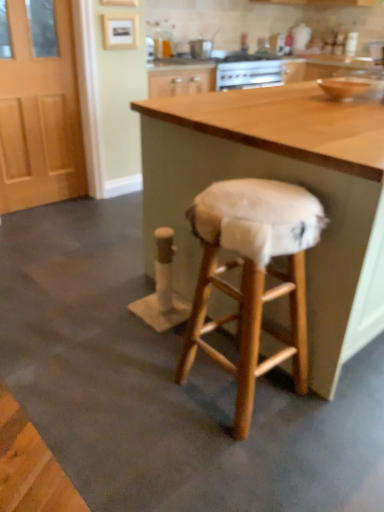
Question: Is light brown wooden door at left not within wooden table at center?

Choices:
 (A) yes
 (B) no

Answer: (A)

Question: Is there a large distance between light brown wooden door at left and wooden table at center?

Choices:
 (A) no
 (B) yes

Answer: (B)

Question: Does light brown wooden door at left turn towards wooden table at center?

Choices:
 (A) no
 (B) yes

Answer: (B)

Question: Is light brown wooden door at left behind wooden table at center?

Choices:
 (A) yes
 (B) no

Answer: (A)

Question: Considering the relative sizes of light brown wooden door at left and wooden table at center in the image provided, is light brown wooden door at left smaller than wooden table at center?

Choices:
 (A) yes
 (B) no

Answer: (A)

Question: Is the position of light brown wooden door at left less distant than that of wooden table at center?

Choices:
 (A) yes
 (B) no

Answer: (B)

Question: Is the depth of white fabric-covered stool at center greater than that of light brown wooden door at left?

Choices:
 (A) yes
 (B) no

Answer: (B)

Question: Does white fabric-covered stool at center contain light brown wooden door at left?

Choices:
 (A) no
 (B) yes

Answer: (A)

Question: From the image's perspective, is white fabric-covered stool at center located above light brown wooden door at left?

Choices:
 (A) no
 (B) yes

Answer: (A)

Question: Is light brown wooden door at left at the back of white fabric-covered stool at center?

Choices:
 (A) no
 (B) yes

Answer: (A)

Question: From a real-world perspective, is white fabric-covered stool at center over light brown wooden door at left?

Choices:
 (A) no
 (B) yes

Answer: (A)

Question: Is white fabric-covered stool at center wider than light brown wooden door at left?

Choices:
 (A) no
 (B) yes

Answer: (B)

Question: Is white fabric-covered stool at center far away from wooden table at center?

Choices:
 (A) no
 (B) yes

Answer: (A)